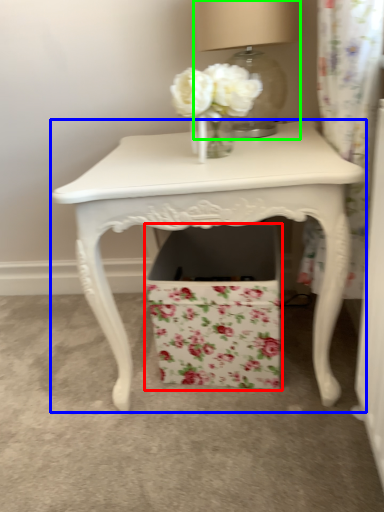
Question: Which object is positioned farthest from cardboard box (highlighted by a red box)? Select from table (highlighted by a blue box) and table lamp (highlighted by a green box).

Choices:
 (A) table
 (B) table lamp

Answer: (B)